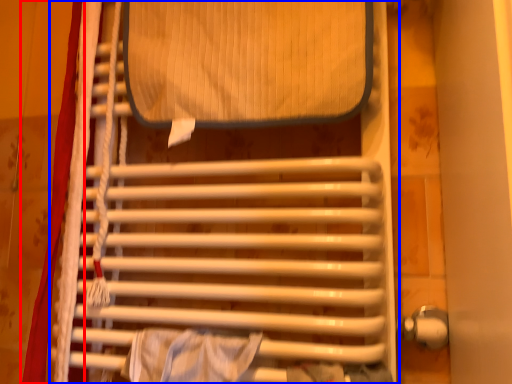
Question: Among these objects, which one is farthest to the camera, curtain (highlighted by a red box) or furniture (highlighted by a blue box)?

Choices:
 (A) curtain
 (B) furniture

Answer: (A)